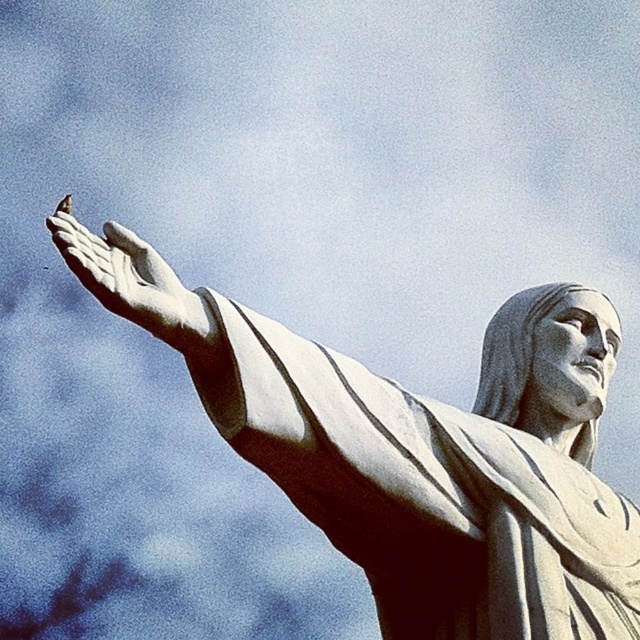
You are standing at the base of the Christ the Redeemer statue and want to look at two specific points on the statue. The first point is at coordinate point(321, 388) and the second is at point(168, 307). Which point is closer to you?

Point(168, 307) is closer to you because it is in front of point(321, 388).

You are an art conservator assessing the statue of Christ. You notice two white marble components, the white marble statue at center and the white marble hand at center. Which component is bigger in size?

The white marble statue at center is larger in size compared to the white marble hand at center.

You are standing in front of the statue and want to take a photo of both the white marble statue at center and the white marble hand at center. Based on their positions, which one should you focus on first to ensure both are in frame?

You should focus on the white marble statue at center first because it is to the right of the white marble hand at center, so positioning the camera to include both would require framing from the hand to the statue.